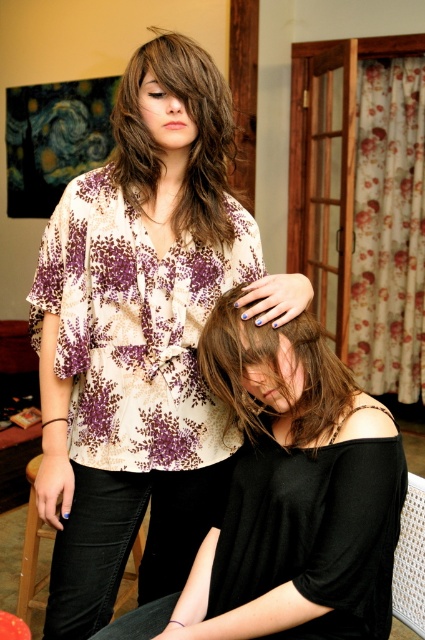
Can you confirm if dark brown wavy hair at upper center is positioned to the right of black leather chair at lower left?

Correct, you'll find dark brown wavy hair at upper center to the right of black leather chair at lower left.

Does point (125, 173) lie behind point (30, 586)?

No.

This screenshot has width=425, height=640. I want to click on dark brown wavy hair at upper center, so click(x=186, y=144).

Can you confirm if black matte hair at center is positioned to the right of brown matte hair at center?

Result: Yes, black matte hair at center is to the right of brown matte hair at center.

Measure the distance from black matte hair at center to brown matte hair at center.

black matte hair at center and brown matte hair at center are 3.57 inches apart.

Between point (359, 572) and point (203, 365), which one is positioned behind?

Point (203, 365)

At what (x,y) coordinates should I click in order to perform the action: click on black matte hair at center. Please return your answer as a coordinate pair (x, y). The height and width of the screenshot is (640, 425). Looking at the image, I should click on (291, 499).

Between black matte hair at center and woven fabric chair at lower right, which one has more height?

Standing taller between the two is black matte hair at center.

Who is lower down, black matte hair at center or woven fabric chair at lower right?

woven fabric chair at lower right is lower down.

Who is more forward, (288, 324) or (416, 476)?

Positioned in front is point (288, 324).

This screenshot has height=640, width=425. I want to click on black matte hair at center, so click(x=291, y=499).